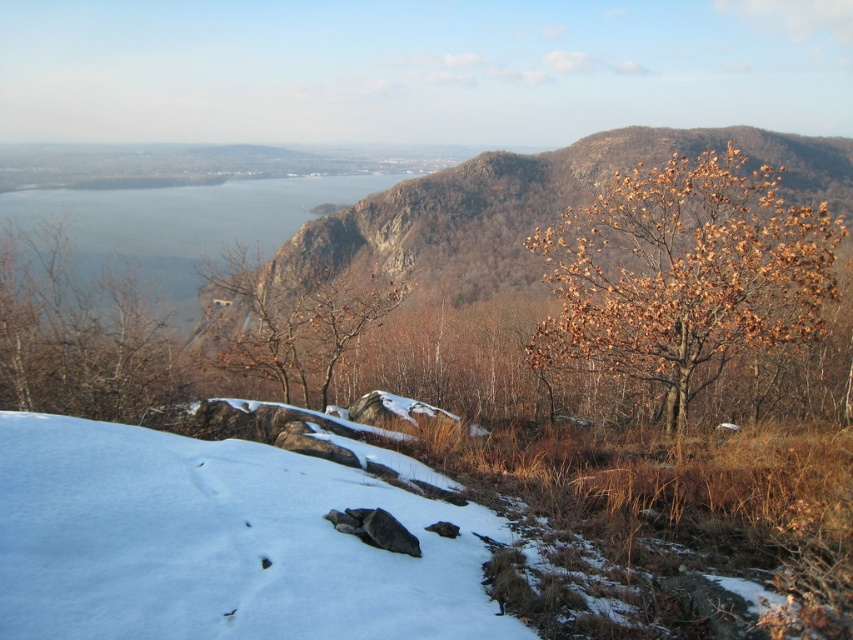
Question: Which point is closer to the camera?

Choices:
 (A) (346, 202)
 (B) (67, 568)
 (C) (543, 342)

Answer: (B)

Question: Which point is closer to the camera?

Choices:
 (A) (73, 422)
 (B) (337, 285)
 (C) (100, 250)
 (D) (183, 368)

Answer: (A)

Question: Among these objects, which one is nearest to the camera?

Choices:
 (A) white fluffy snow at lower left
 (B) brown leafy tree at right
 (C) brown leafy tree at center
 (D) brown leafy tree at left

Answer: (A)

Question: Is brown leafy tree at right above brown leafy tree at center?

Choices:
 (A) no
 (B) yes

Answer: (B)

Question: Can you confirm if blue water at left is positioned to the left of brown leafy tree at center?

Choices:
 (A) no
 (B) yes

Answer: (B)

Question: Can you confirm if brown leafy tree at left is positioned above brown leafy tree at center?

Choices:
 (A) no
 (B) yes

Answer: (B)